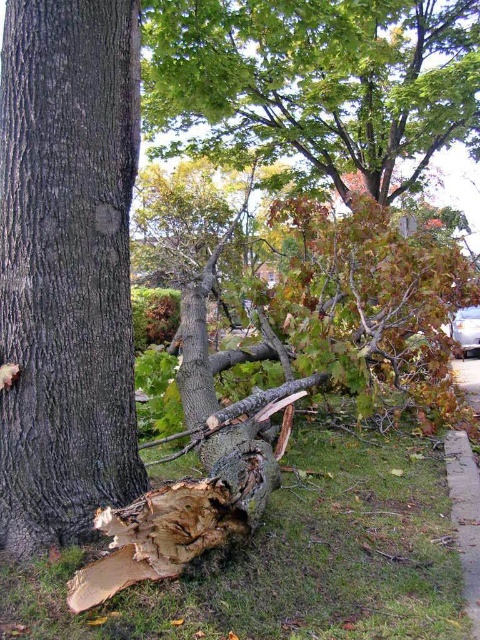
You are a botanist examining the scene. You need to determine the direction of the tree trunk relative to the green leafy part. Based on the image, which side of the green leafy tree at center is the dark brown rough bark at center located?

The dark brown rough bark at center is positioned on the left side of the green leafy tree at center.

You are a botanist examining two trees in the image. The dark brown rough bark at center and the green leafy tree at center. Which tree has a wider trunk?

The green leafy tree at center has a wider trunk than the dark brown rough bark at center since the dark brown rough bark at center is narrower in width according to the description.